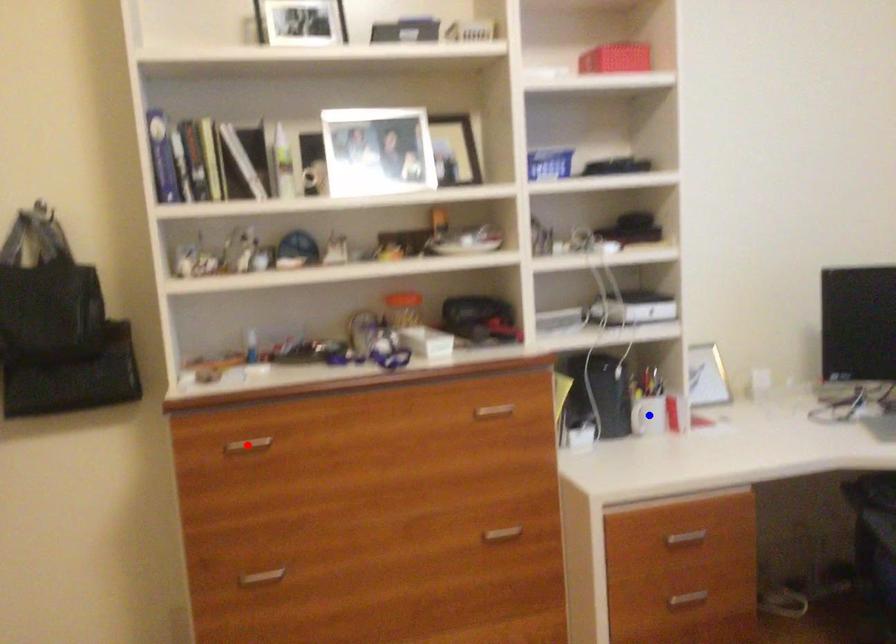
Question: Two points are marked on the image. Which point is closer to the camera?

Choices:
 (A) Blue point is closer.
 (B) Red point is closer.

Answer: (B)